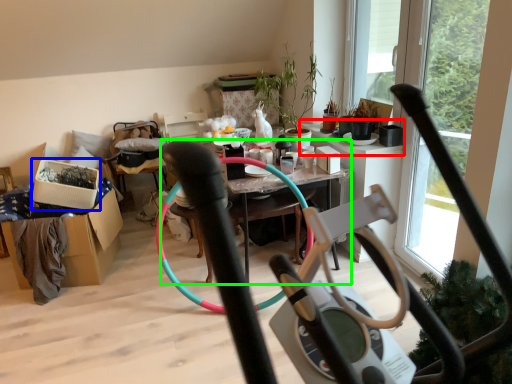
Question: Considering the real-world distances, which object is closest to window sill (highlighted by a red box)? box (highlighted by a blue box) or table (highlighted by a green box).

Choices:
 (A) box
 (B) table

Answer: (A)